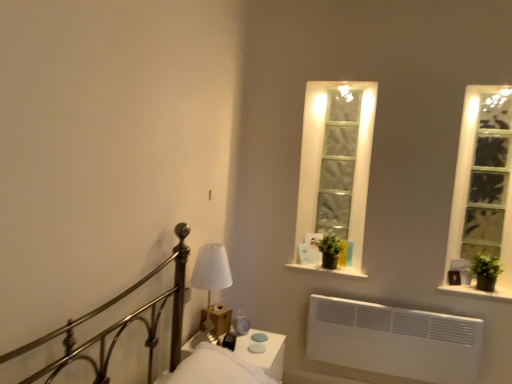
Question: Is green matte plant at right, which appears as the first plant when viewed from the front, in front of or behind clear glass window at right in the image?

Choices:
 (A) front
 (B) behind

Answer: (A)

Question: In terms of width, does green matte plant at right, which appears as the first plant when viewed from the front, look wider or thinner when compared to clear glass window at right?

Choices:
 (A) wide
 (B) thin

Answer: (B)

Question: Based on their relative distances, which object is farther from the green matte plant at right, acting as the second window sill starting from the top?

Choices:
 (A) white glossy nightstand at lower center
 (B) green matte plant at center, the 2th plant viewed from the right
 (C) green matte plant at right, which ranks as the 2th plant in left-to-right order
 (D) clear glass window at right
 (E) white fabric lampshade at center

Answer: (E)

Question: Estimate the real-world distances between objects in this image. Which object is farther from the metallic bed at left?

Choices:
 (A) black matte window sill at center, the 1th window sill in the left-to-right sequence
 (B) green matte plant at center, which is counted as the 1th plant, starting from the left
 (C) white fabric lampshade at center
 (D) green matte plant at right, which ranks as the 2th plant in left-to-right order
 (E) green matte plant at right, which is the first window sill in right-to-left order

Answer: (D)